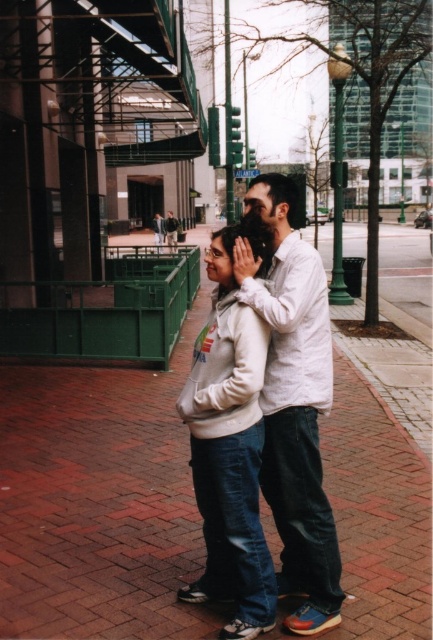
Question: Does white cotton shirt at center have a larger size compared to white fleece jacket at center?

Choices:
 (A) yes
 (B) no

Answer: (B)

Question: Which of the following is the farthest from the observer?

Choices:
 (A) white cotton shirt at center
 (B) white fleece jacket at center

Answer: (A)

Question: Is white cotton shirt at center thinner than white fleece jacket at center?

Choices:
 (A) no
 (B) yes

Answer: (A)

Question: Can you confirm if white cotton shirt at center is smaller than white fleece jacket at center?

Choices:
 (A) yes
 (B) no

Answer: (A)

Question: Which point is farther to the camera?

Choices:
 (A) white cotton shirt at center
 (B) white fleece jacket at center

Answer: (A)